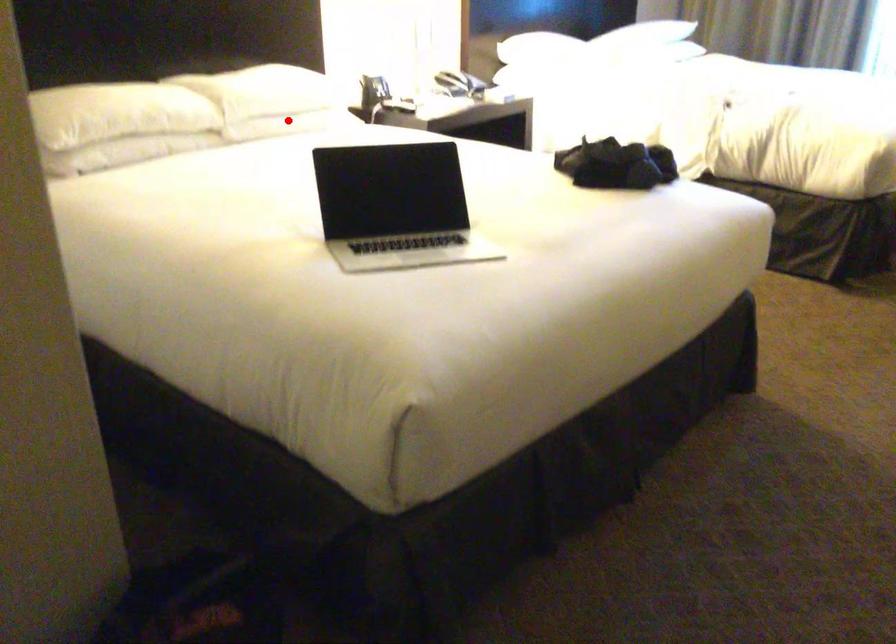
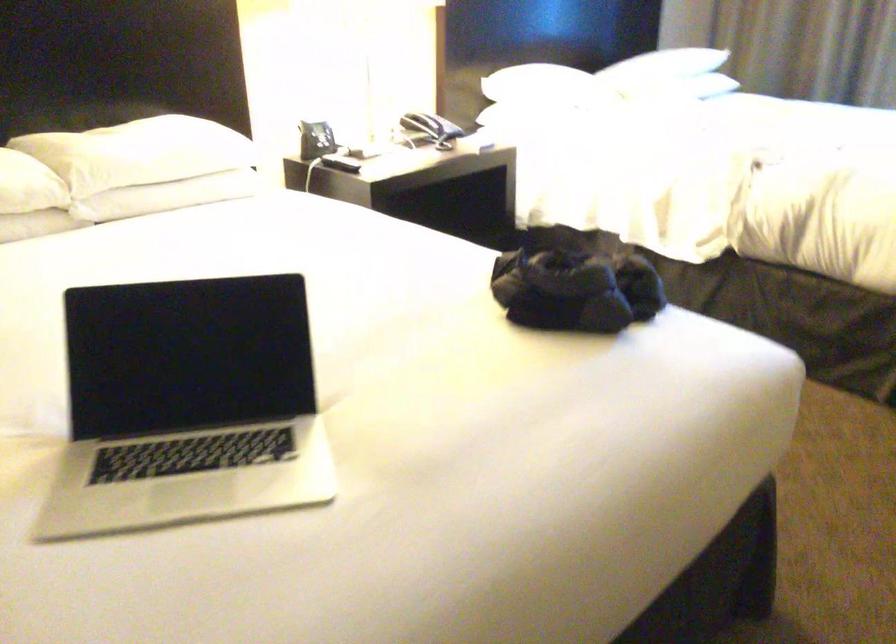
Question: I am providing you with two images of the same scene from different viewpoints. Given a red point in image1, look at the same physical point in image2. Is it:

Choices:
 (A) Closer to the viewpoint
 (B) Farther from the viewpoint

Answer: (A)